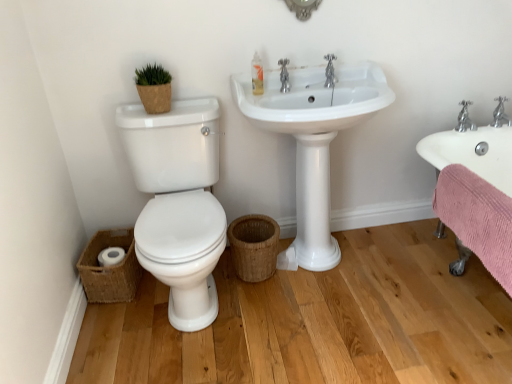
Question: Does translucent plastic soap dispenser at upper center come in front of chrome metallic faucet at upper right, the 1th tap in the bottom-to-top sequence?

Choices:
 (A) no
 (B) yes

Answer: (B)

Question: Can you confirm if translucent plastic soap dispenser at upper center is smaller than chrome metallic faucet at upper right, the 1th tap in the bottom-to-top sequence?

Choices:
 (A) yes
 (B) no

Answer: (A)

Question: Is translucent plastic soap dispenser at upper center to the right of chrome metallic faucet at upper right, the 1th tap from the right, from the viewer's perspective?

Choices:
 (A) no
 (B) yes

Answer: (A)

Question: Does translucent plastic soap dispenser at upper center have a larger size compared to chrome metallic faucet at upper right, the 1th tap in the bottom-to-top sequence?

Choices:
 (A) no
 (B) yes

Answer: (A)

Question: Can you confirm if translucent plastic soap dispenser at upper center is shorter than chrome metallic faucet at upper right, the 1th tap in the bottom-to-top sequence?

Choices:
 (A) yes
 (B) no

Answer: (B)

Question: Is translucent plastic soap dispenser at upper center next to chrome metallic faucet at upper right, the 1th tap from the right, and touching it?

Choices:
 (A) yes
 (B) no

Answer: (B)

Question: Is chrome metallic faucet at upper center, marked as the 1th tap in a left-to-right arrangement, positioned behind white glossy toilet at left?

Choices:
 (A) no
 (B) yes

Answer: (B)

Question: From the image's perspective, would you say chrome metallic faucet at upper center, which ranks as the 1th tap in top-to-bottom order, is shown under white glossy toilet at left?

Choices:
 (A) yes
 (B) no

Answer: (B)

Question: Can you confirm if chrome metallic faucet at upper center, which is the 2th tap from bottom to top, is taller than white glossy toilet at left?

Choices:
 (A) no
 (B) yes

Answer: (A)

Question: Is chrome metallic faucet at upper center, which is the 2th tap from bottom to top, next to white glossy toilet at left?

Choices:
 (A) yes
 (B) no

Answer: (B)

Question: Is chrome metallic faucet at upper center, placed as the 2th tap when sorted from right to left, to the left of white glossy toilet at left from the viewer's perspective?

Choices:
 (A) yes
 (B) no

Answer: (B)

Question: Is white glossy toilet at left inside chrome metallic faucet at upper center, which ranks as the 1th tap in top-to-bottom order?

Choices:
 (A) yes
 (B) no

Answer: (B)

Question: Is white glossy sink at center, the first sink positioned from the left, further to camera compared to white glossy toilet at left?

Choices:
 (A) yes
 (B) no

Answer: (A)